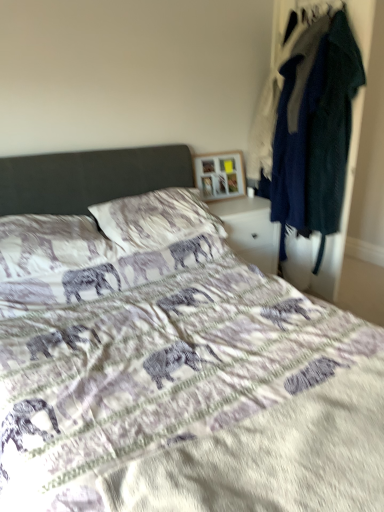
Question: Is textured cotton pillow at center, acting as the first pillow starting from the left, taller or shorter than printed fabric bed at center?

Choices:
 (A) tall
 (B) short

Answer: (B)

Question: Considering the relative positions of textured cotton pillow at center, acting as the first pillow starting from the left, and printed fabric bed at center in the image provided, is textured cotton pillow at center, acting as the first pillow starting from the left, to the left or to the right of printed fabric bed at center?

Choices:
 (A) left
 (B) right

Answer: (A)

Question: Which is farther from the wooden picture frame at upper center?

Choices:
 (A) white glossy nightstand at center
 (B) textured cotton pillow at center, arranged as the 2th pillow when viewed from the right
 (C) dark blue fabric coat at right
 (D) printed fabric bed at center
 (E) textured white pillow at center, acting as the 1th pillow starting from the right

Answer: (B)

Question: Considering the real-world distances, which object is farthest from the textured white pillow at center, arranged as the 2th pillow when viewed from the left?

Choices:
 (A) textured cotton pillow at center, arranged as the 2th pillow when viewed from the right
 (B) white glossy nightstand at center
 (C) wooden picture frame at upper center
 (D) printed fabric bed at center
 (E) dark blue fabric coat at right

Answer: (E)